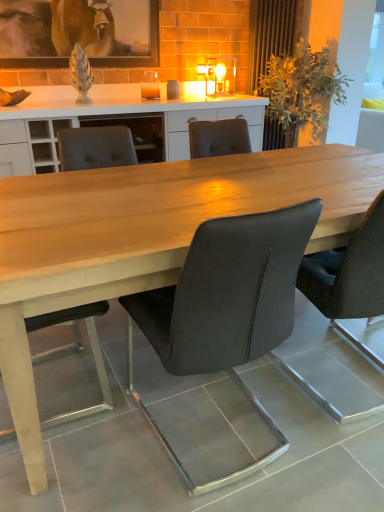
The width and height of the screenshot is (384, 512). What do you see at coordinates (79, 32) in the screenshot?
I see `matte wooden picture frame at upper center` at bounding box center [79, 32].

At what (x,y) coordinates should I click in order to perform the action: click on light wood table at center. Please return your answer as a coordinate pair (x, y). Looking at the image, I should click on (145, 238).

Identify the location of matte black chair at center, positioned as the 1th chair in right-to-left order. (349, 276).

This screenshot has width=384, height=512. Find the location of `matte black chair at center, which appears as the third chair when viewed from the right`. matte black chair at center, which appears as the third chair when viewed from the right is located at coordinates (96, 148).

From a real-world perspective, does matte black chair at center, positioned as the 1th chair in right-to-left order, stand above matte black chair at center, marked as the 2th chair in a left-to-right arrangement?

Actually, matte black chair at center, positioned as the 1th chair in right-to-left order, is physically below matte black chair at center, marked as the 2th chair in a left-to-right arrangement, in the real world.

Is matte black chair at center, which is counted as the 3th chair, starting from the left, closer to the viewer compared to matte black chair at center, which ranks as the 2th chair in right-to-left order?

No, it is behind matte black chair at center, which ranks as the 2th chair in right-to-left order.

Can you confirm if matte black chair at center, which is counted as the 3th chair, starting from the left, is wider than matte black chair at center, which ranks as the 2th chair in right-to-left order?

No.

Is matte black chair at center, which is counted as the 3th chair, starting from the left, aimed at matte black chair at center, marked as the 2th chair in a left-to-right arrangement?

No, matte black chair at center, which is counted as the 3th chair, starting from the left, is not oriented towards matte black chair at center, marked as the 2th chair in a left-to-right arrangement.

Looking at this image, is there a large distance between light wood table at center and matte black chair at center, marked as the 2th chair in a left-to-right arrangement?

light wood table at center is actually quite close to matte black chair at center, marked as the 2th chair in a left-to-right arrangement.

Which is behind, point (177, 208) or point (133, 390)?

The point (133, 390) is farther.

Looking at this image, between light wood table at center and matte black chair at center, marked as the 2th chair in a left-to-right arrangement, which one has more height?

matte black chair at center, marked as the 2th chair in a left-to-right arrangement.

From the image's perspective, relative to matte black chair at center, which ranks as the 2th chair in right-to-left order, is light wood table at center above or below?

From the image's perspective, light wood table at center appears above matte black chair at center, which ranks as the 2th chair in right-to-left order.

Is matte black chair at center, which ranks as the 2th chair in right-to-left order, located outside matte black chair at center, positioned as the 1th chair in right-to-left order?

matte black chair at center, which ranks as the 2th chair in right-to-left order, lies outside matte black chair at center, positioned as the 1th chair in right-to-left order,'s area.

From a real-world perspective, which object rests below the other?

matte black chair at center, which is counted as the 3th chair, starting from the left, is physically lower.

Which object is further away from the camera, matte black chair at center, which ranks as the 2th chair in right-to-left order, or matte black chair at center, which is counted as the 3th chair, starting from the left?

matte black chair at center, which is counted as the 3th chair, starting from the left, is further from the camera.

Does matte black chair at center, marked as the 2th chair in a left-to-right arrangement, have a greater height compared to matte black chair at center, positioned as the 1th chair in right-to-left order?

In fact, matte black chair at center, marked as the 2th chair in a left-to-right arrangement, may be shorter than matte black chair at center, positioned as the 1th chair in right-to-left order.

Is matte black chair at center, marked as the 2th chair in a left-to-right arrangement, facing towards light wood table at center?

Yes, matte black chair at center, marked as the 2th chair in a left-to-right arrangement, is oriented towards light wood table at center.

Which is behind, point (238, 230) or point (54, 181)?

Positioned behind is point (54, 181).

Which is more to the right, matte black chair at center, which ranks as the 2th chair in right-to-left order, or light wood table at center?

light wood table at center.

Considering the sizes of objects matte wooden picture frame at upper center and matte black chair at center, which appears as the third chair when viewed from the right, in the image provided, who is taller, matte wooden picture frame at upper center or matte black chair at center, which appears as the third chair when viewed from the right,?

matte black chair at center, which appears as the third chair when viewed from the right, is taller.

Looking at this image, between matte wooden picture frame at upper center and matte black chair at center, the 1th chair viewed from the left, which one appears on the right side from the viewer's perspective?

Positioned to the right is matte black chair at center, the 1th chair viewed from the left.

Does matte wooden picture frame at upper center turn towards matte black chair at center, the 1th chair viewed from the left?

No, matte wooden picture frame at upper center is not facing towards matte black chair at center, the 1th chair viewed from the left.

Based on the photo, considering the relative positions of light wood table at center and matte black chair at center, which appears as the third chair when viewed from the right, in the image provided, is light wood table at center to the left of matte black chair at center, which appears as the third chair when viewed from the right, from the viewer's perspective?

No.

Does light wood table at center turn towards matte black chair at center, which appears as the third chair when viewed from the right?

Yes.

Considering their positions, is light wood table at center located in front of or behind matte black chair at center, which appears as the third chair when viewed from the right?

Visually, light wood table at center is located in front of matte black chair at center, which appears as the third chair when viewed from the right.

Between point (12, 333) and point (111, 403), which one is positioned in front?

Positioned in front is point (12, 333).

Could matte black chair at center, which ranks as the 2th chair in right-to-left order, be considered to be inside matte wooden picture frame at upper center?

Actually, matte black chair at center, which ranks as the 2th chair in right-to-left order, is outside matte wooden picture frame at upper center.

Considering the relative sizes of matte wooden picture frame at upper center and matte black chair at center, which ranks as the 2th chair in right-to-left order, in the image provided, is matte wooden picture frame at upper center shorter than matte black chair at center, which ranks as the 2th chair in right-to-left order,?

Indeed, matte wooden picture frame at upper center has a lesser height compared to matte black chair at center, which ranks as the 2th chair in right-to-left order.

From a real-world perspective, which is physically above, matte wooden picture frame at upper center or matte black chair at center, which ranks as the 2th chair in right-to-left order?

matte wooden picture frame at upper center is physically above.

Find the location of a particular element. chair that is the 2nd one when counting downward from the matte black chair at center, which is counted as the 3th chair, starting from the left (from the image's perspective) is located at coordinates (227, 306).

Find the location of `chair in front of the light wood table at center`. chair in front of the light wood table at center is located at coordinates (227, 306).

Consider the image. Looking at the image, which one is located closer to matte black chair at center, which is counted as the 3th chair, starting from the left, matte wooden picture frame at upper center or matte black chair at center, which ranks as the 2th chair in right-to-left order?

matte black chair at center, which ranks as the 2th chair in right-to-left order, is positioned closer to the anchor matte black chair at center, which is counted as the 3th chair, starting from the left.

Looking at the image, which one is located further to matte black chair at center, which appears as the third chair when viewed from the right, matte wooden picture frame at upper center or light wood table at center?

matte wooden picture frame at upper center is further to matte black chair at center, which appears as the third chair when viewed from the right.

Looking at the image, which one is located further to matte black chair at center, which appears as the third chair when viewed from the right, light wood table at center or matte wooden picture frame at upper center?

Based on the image, matte wooden picture frame at upper center appears to be further to matte black chair at center, which appears as the third chair when viewed from the right.

Estimate the real-world distances between objects in this image. Which object is further from light wood table at center, matte black chair at center, which appears as the third chair when viewed from the right, or matte wooden picture frame at upper center?

matte wooden picture frame at upper center is further to light wood table at center.

From the image, which object appears to be farther from matte black chair at center, which appears as the third chair when viewed from the right, light wood table at center or matte black chair at center, positioned as the 1th chair in right-to-left order?

matte black chair at center, positioned as the 1th chair in right-to-left order, is positioned further to the anchor matte black chair at center, which appears as the third chair when viewed from the right.

Looking at the image, which one is located further to matte black chair at center, which ranks as the 2th chair in right-to-left order, light wood table at center or matte wooden picture frame at upper center?

matte wooden picture frame at upper center.

Considering their positions, is matte wooden picture frame at upper center positioned closer to light wood table at center than matte black chair at center, which is counted as the 3th chair, starting from the left?

Among the two, matte black chair at center, which is counted as the 3th chair, starting from the left, is located nearer to light wood table at center.

When comparing their distances from light wood table at center, does matte wooden picture frame at upper center or matte black chair at center, the 1th chair viewed from the left, seem closer?

The object closer to light wood table at center is matte black chair at center, the 1th chair viewed from the left.

The width and height of the screenshot is (384, 512). I want to click on chair situated between matte black chair at center, the 1th chair viewed from the left, and matte black chair at center, which is counted as the 3th chair, starting from the left, from left to right, so click(x=227, y=306).

Identify the location of chair between matte wooden picture frame at upper center and matte black chair at center, the 1th chair viewed from the left, vertically. The width and height of the screenshot is (384, 512). (349, 276).

At what (x,y) coordinates should I click in order to perform the action: click on table between matte black chair at center, which ranks as the 2th chair in right-to-left order, and matte wooden picture frame at upper center in the front-back direction. Please return your answer as a coordinate pair (x, y). This screenshot has height=512, width=384. Looking at the image, I should click on (145, 238).

Find the location of a particular element. The width and height of the screenshot is (384, 512). table between matte black chair at center, marked as the 2th chair in a left-to-right arrangement, and matte black chair at center, which is counted as the 3th chair, starting from the left is located at coordinates (145, 238).